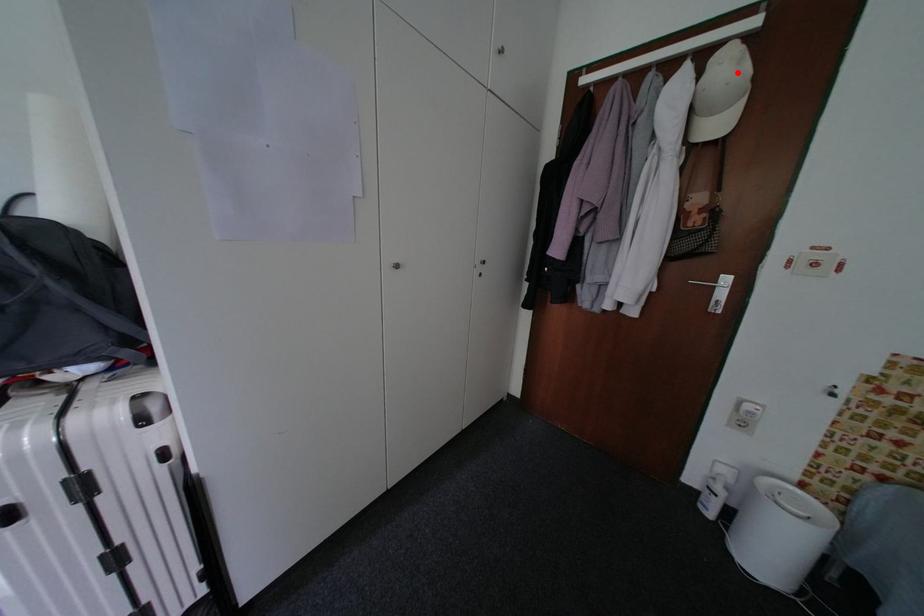
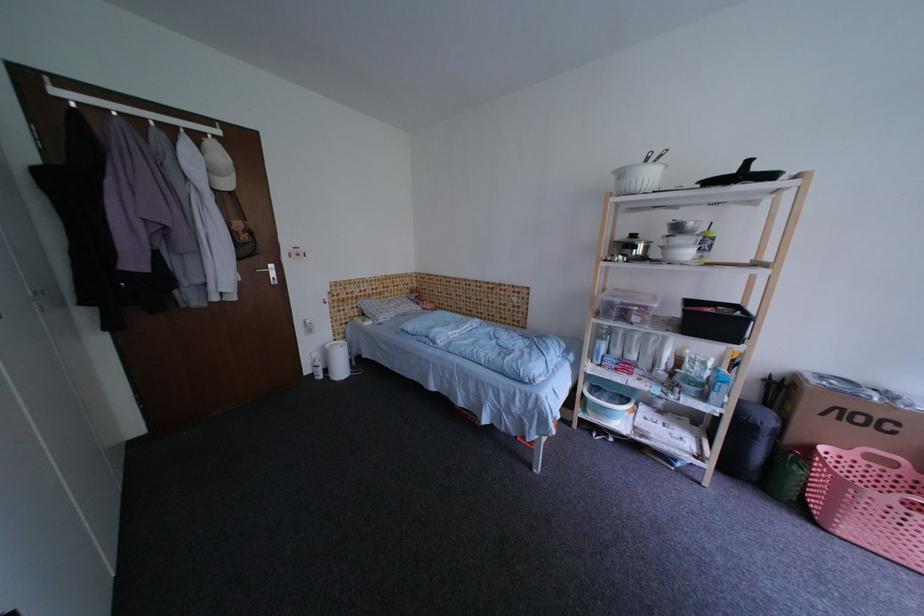
The point at the highlighted location is marked in the first image. Where is the corresponding point in the second image?

(227, 158)